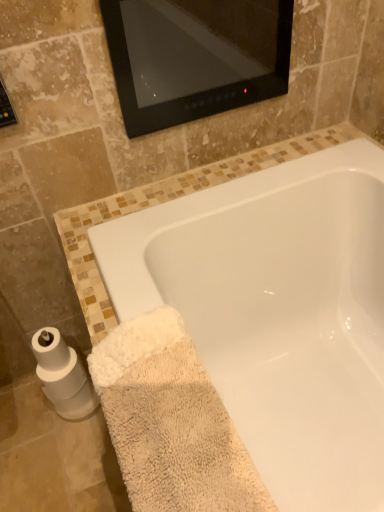
The height and width of the screenshot is (512, 384). What do you see at coordinates (171, 422) in the screenshot?
I see `beige fluffy towel at lower left` at bounding box center [171, 422].

Locate an element on the screen. white matte toilet paper at lower left is located at coordinates (63, 375).

Find the location of a particular element. This screenshot has width=384, height=512. beige fluffy towel at lower left is located at coordinates (171, 422).

Considering the positions of objects beige fluffy towel at lower left and white glossy bathtub at lower center in the image provided, who is more to the left, beige fluffy towel at lower left or white glossy bathtub at lower center?

beige fluffy towel at lower left.

From a real-world perspective, relative to white glossy bathtub at lower center, is beige fluffy towel at lower left vertically above or below?

beige fluffy towel at lower left is above white glossy bathtub at lower center.

Are beige fluffy towel at lower left and white glossy bathtub at lower center beside each other?

No, beige fluffy towel at lower left is not next to white glossy bathtub at lower center.

How many degrees apart are the facing directions of beige fluffy towel at lower left and white glossy bathtub at lower center?

0.608 degrees separate the facing orientations of beige fluffy towel at lower left and white glossy bathtub at lower center.

Does beige fluffy towel at lower left have a larger size compared to white matte toilet paper at lower left?

Yes.

From the image's perspective, between beige fluffy towel at lower left and white matte toilet paper at lower left, which one is located above?

white matte toilet paper at lower left.

From a real-world perspective, which object stands above the other?

beige fluffy towel at lower left.

Which object is positioned more to the left, beige fluffy towel at lower left or white matte toilet paper at lower left?

white matte toilet paper at lower left is more to the left.

Can you confirm if white glossy bathtub at lower center is taller than beige fluffy towel at lower left?

Correct, white glossy bathtub at lower center is much taller as beige fluffy towel at lower left.

Can we say white glossy bathtub at lower center lies outside beige fluffy towel at lower left?

Yes.

Which object is further away from the camera taking this photo, white glossy bathtub at lower center or beige fluffy towel at lower left?

white glossy bathtub at lower center is behind.

Does point (221, 347) come closer to viewer compared to point (124, 355)?

No.

Is white matte toilet paper at lower left at the left side of beige fluffy towel at lower left?

Yes, white matte toilet paper at lower left is to the left of beige fluffy towel at lower left.

Do you think white matte toilet paper at lower left is within beige fluffy towel at lower left, or outside of it?

white matte toilet paper at lower left is spatially situated outside beige fluffy towel at lower left.

Are white matte toilet paper at lower left and beige fluffy towel at lower left making contact?

No, white matte toilet paper at lower left is not next to beige fluffy towel at lower left.

Locate an element on the screen. toilet paper lying behind the beige fluffy towel at lower left is located at coordinates (63, 375).

From a real-world perspective, is white glossy bathtub at lower center positioned over white matte toilet paper at lower left based on gravity?

Correct, in the physical world, white glossy bathtub at lower center is higher than white matte toilet paper at lower left.

In terms of height, does white glossy bathtub at lower center look taller or shorter compared to white matte toilet paper at lower left?

white glossy bathtub at lower center is taller than white matte toilet paper at lower left.

Does white glossy bathtub at lower center lie behind white matte toilet paper at lower left?

No, it is not.

How different are the orientations of white matte toilet paper at lower left and white glossy bathtub at lower center in degrees?

There is a 91.5-degree angle between the facing directions of white matte toilet paper at lower left and white glossy bathtub at lower center.

From the image's perspective, does white matte toilet paper at lower left appear higher than white glossy bathtub at lower center?

No, from the image's perspective, white matte toilet paper at lower left is not on top of white glossy bathtub at lower center.

Is point (55, 400) positioned in front of point (286, 224)?

No, it is not.

In terms of width, does white matte toilet paper at lower left look wider or thinner when compared to white glossy bathtub at lower center?

Clearly, white matte toilet paper at lower left has less width compared to white glossy bathtub at lower center.

In order to click on bathtub above the beige fluffy towel at lower left (from the image's perspective) in this screenshot , I will do `click(278, 313)`.

Locate an element on the screen. bath towel lying on the right of white matte toilet paper at lower left is located at coordinates (171, 422).

Which object lies further to the anchor point beige fluffy towel at lower left, white glossy bathtub at lower center or white matte toilet paper at lower left?

white matte toilet paper at lower left lies further to beige fluffy towel at lower left than the other object.

Which object lies nearer to the anchor point white matte toilet paper at lower left, white glossy bathtub at lower center or beige fluffy towel at lower left?

Based on the image, beige fluffy towel at lower left appears to be nearer to white matte toilet paper at lower left.

Estimate the real-world distances between objects in this image. Which object is further from white glossy bathtub at lower center, white matte toilet paper at lower left or beige fluffy towel at lower left?

Among the two, white matte toilet paper at lower left is located further to white glossy bathtub at lower center.

When comparing their distances from white matte toilet paper at lower left, does beige fluffy towel at lower left or white glossy bathtub at lower center seem further?

Based on the image, white glossy bathtub at lower center appears to be further to white matte toilet paper at lower left.

When comparing their distances from white glossy bathtub at lower center, does beige fluffy towel at lower left or white matte toilet paper at lower left seem further?

white matte toilet paper at lower left is positioned further to the anchor white glossy bathtub at lower center.

Estimate the real-world distances between objects in this image. Which object is further from beige fluffy towel at lower left, white matte toilet paper at lower left or white glossy bathtub at lower center?

white matte toilet paper at lower left.

Locate an element on the screen. This screenshot has width=384, height=512. bathtub positioned between beige fluffy towel at lower left and white matte toilet paper at lower left from near to far is located at coordinates (278, 313).